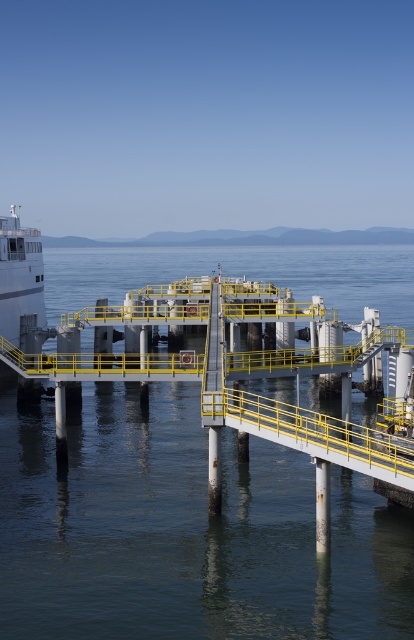
Is clear blue water at center above white glossy ship at left?

Yes.

Where is `clear blue water at center`? The height and width of the screenshot is (640, 414). clear blue water at center is located at coordinates (185, 532).